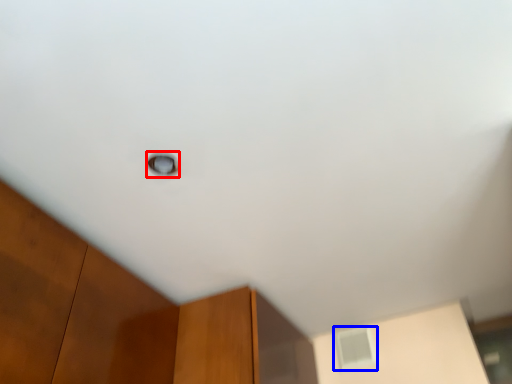
Question: Which point is closer to the camera, window (highlighted by a red box) or window (highlighted by a blue box)?

Choices:
 (A) window
 (B) window

Answer: (A)